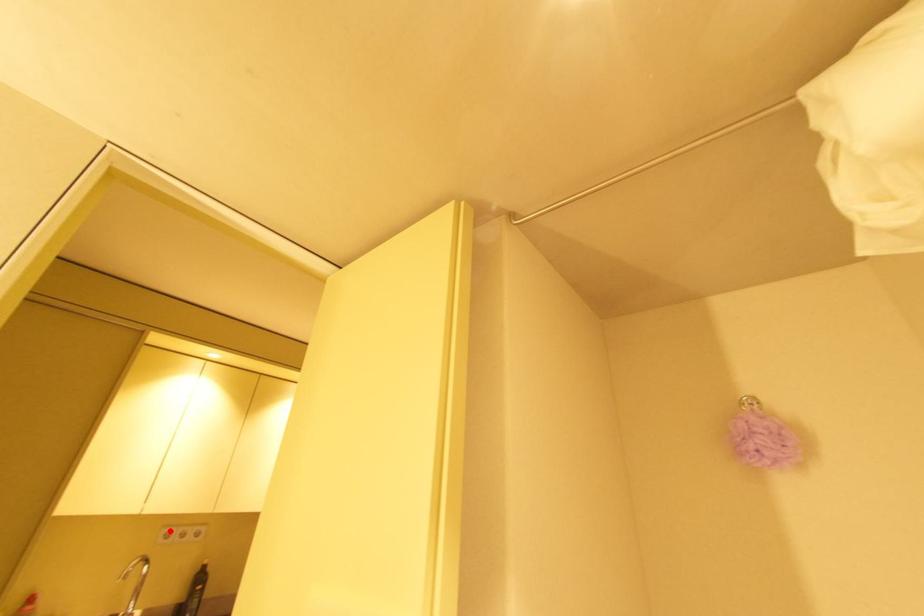
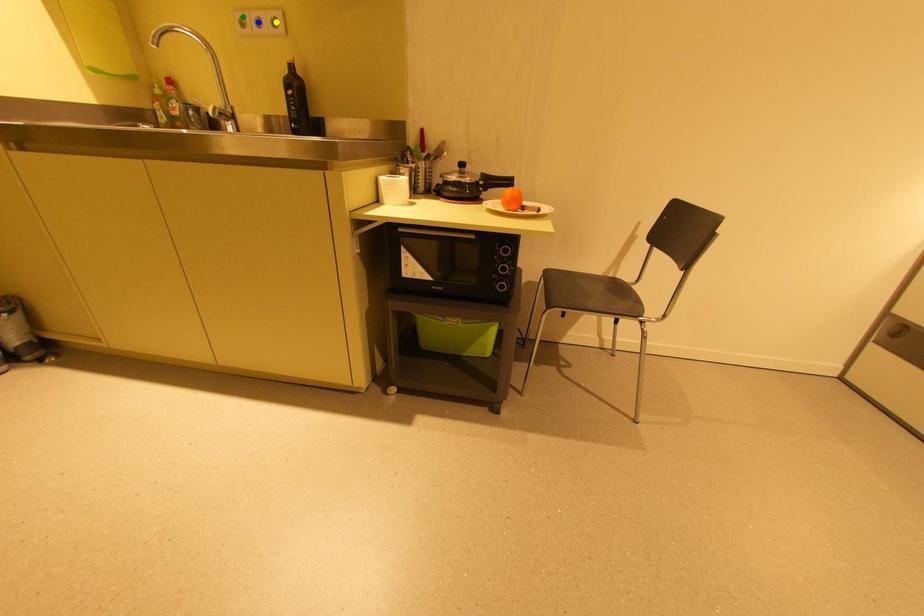
Question: I am providing you with two images of the same scene from different viewpoints. A red point is marked on the first image. You are given multiple points on the second image. Which point in image 2 represents the same 3d spot as the red point in image 1?

Choices:
 (A) yellow point
 (B) green point
 (C) blue point

Answer: (B)